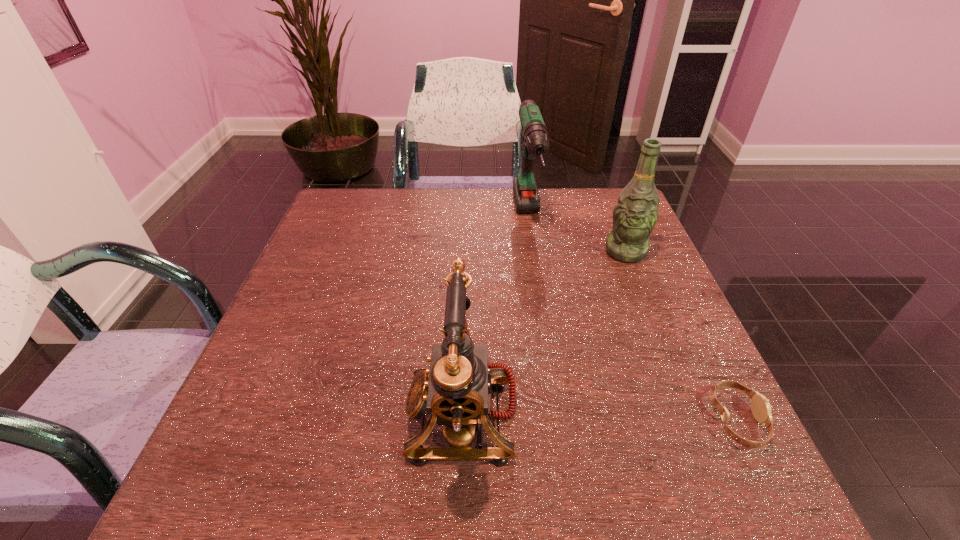
Image resolution: width=960 pixels, height=540 pixels. I want to click on empty location between the beer bottle and the third object from right to left, so click(577, 235).

What are the coordinates of `free area in between the drill and the beer bottle` in the screenshot? It's located at (577, 235).

At what (x,y) coordinates should I click in order to perform the action: click on vacant space in between the telephone and the watch. Please return your answer as a coordinate pair (x, y). The height and width of the screenshot is (540, 960). Looking at the image, I should click on (600, 417).

Locate an element on the screen. Image resolution: width=960 pixels, height=540 pixels. free space between the beer bottle and the shortest object is located at coordinates (682, 336).

The width and height of the screenshot is (960, 540). Find the location of `free space between the drill and the beer bottle`. free space between the drill and the beer bottle is located at coordinates (577, 235).

Choose which object is the third nearest neighbor to the beer bottle. Please provide its 2D coordinates. Your answer should be formatted as a tuple, i.e. [(x, y)], where the tuple contains the x and y coordinates of a point satisfying the conditions above.

[(456, 390)]

I want to click on object that stands as the third closest to the beer bottle, so click(x=456, y=390).

Locate an element on the screen. vacant space that satisfies the following two spatial constraints: 1. on the front side of the shortest object; 2. on the face of the second object from left to right is located at coordinates (558, 421).

Locate an element on the screen. free space that satisfies the following two spatial constraints: 1. on the front side of the watch; 2. on the face of the beer bottle is located at coordinates (694, 421).

At what (x,y) coordinates should I click in order to perform the action: click on free space that satisfies the following two spatial constraints: 1. on the front side of the beer bottle; 2. on the left side of the drill. Please return your answer as a coordinate pair (x, y). Image resolution: width=960 pixels, height=540 pixels. Looking at the image, I should click on (533, 252).